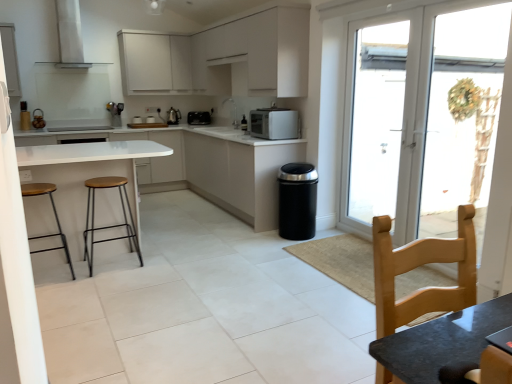
I want to click on empty space that is to the right of white glossy table at center, so click(206, 254).